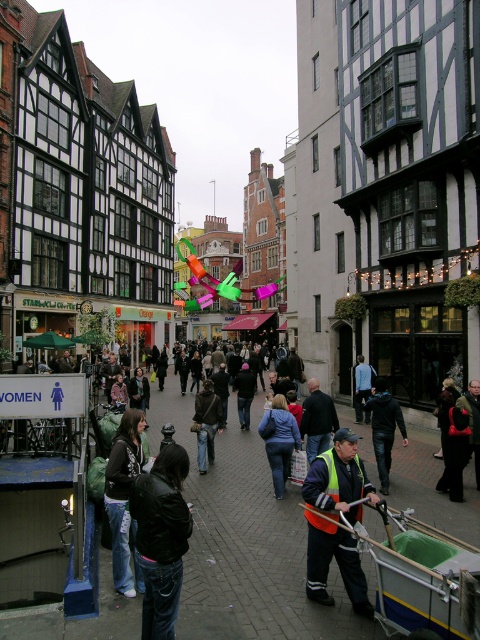
Question: Can you confirm if metallic silver cart at lower right is positioned to the left of dark brown leather jacket at lower left?

Choices:
 (A) yes
 (B) no

Answer: (B)

Question: Among these objects, which one is farthest from the camera?

Choices:
 (A) dark blue jacket at center
 (B) blue fabric jacket at center
 (C) reflective orange vest at center

Answer: (B)

Question: Is dark brown leather jacket at lower left below blue denim jacket at center?

Choices:
 (A) no
 (B) yes

Answer: (B)

Question: Which of these objects is positioned closest to the metallic silver cart at lower right?

Choices:
 (A) dark blue leather jacket at center
 (B) dark brown leather jacket at lower left
 (C) black leather jacket at lower left

Answer: (C)

Question: Which point is farther to the camera?

Choices:
 (A) (197, 406)
 (B) (276, 413)
 (C) (315, 531)

Answer: (A)

Question: Can you confirm if black leather jacket at lower left is smaller than blue fabric jacket at center?

Choices:
 (A) no
 (B) yes

Answer: (A)